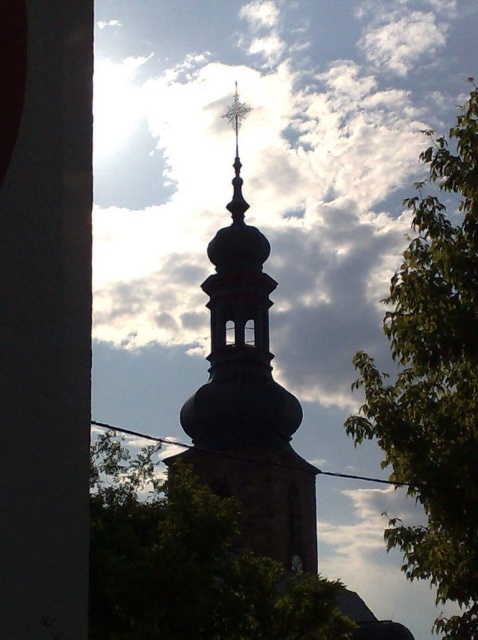
Question: Does green leafy tree at center appear over dark brown stone tower at center?

Choices:
 (A) yes
 (B) no

Answer: (B)

Question: Is green leafy tree at right further to the viewer compared to dark brown stone tower at center?

Choices:
 (A) no
 (B) yes

Answer: (A)

Question: Among these objects, which one is nearest to the camera?

Choices:
 (A) green leafy tree at right
 (B) dark brown stone tower at center

Answer: (A)

Question: Considering the relative positions of green leafy tree at center and dark brown stone tower at center in the image provided, where is green leafy tree at center located with respect to dark brown stone tower at center?

Choices:
 (A) left
 (B) right

Answer: (A)

Question: Estimate the real-world distances between objects in this image. Which object is closer to the green leafy tree at right?

Choices:
 (A) dark brown stone tower at center
 (B) green leafy tree at center

Answer: (B)

Question: Considering the real-world distances, which object is closest to the green leafy tree at right?

Choices:
 (A) green leafy tree at center
 (B) dark brown stone tower at center

Answer: (A)